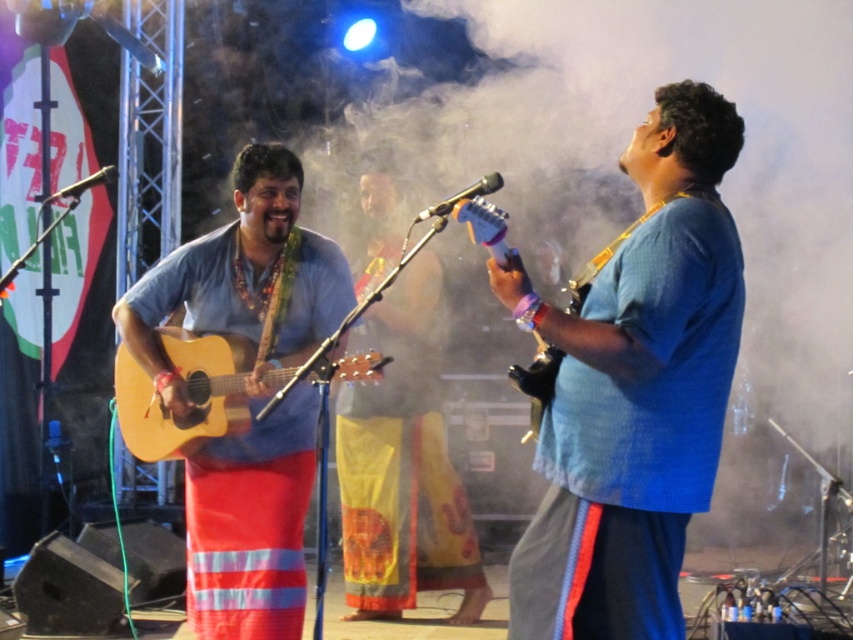
Is matte wood guitar at left thinner than acoustic wood guitar at left?

Correct, matte wood guitar at left's width is less than acoustic wood guitar at left's.

Does point (213, 230) lie behind point (202, 428)?

Yes.

At what (x,y) coordinates should I click in order to perform the action: click on matte wood guitar at left. Please return your answer as a coordinate pair (x, y). The height and width of the screenshot is (640, 853). Looking at the image, I should click on (242, 280).

Is blue cotton shirt at center closer to camera compared to acoustic wood guitar at left?

Yes, it is.

Which is above, blue cotton shirt at center or acoustic wood guitar at left?

blue cotton shirt at center

This screenshot has height=640, width=853. What do you see at coordinates (635, 388) in the screenshot?
I see `blue cotton shirt at center` at bounding box center [635, 388].

The width and height of the screenshot is (853, 640). Identify the location of blue cotton shirt at center. (635, 388).

Describe the element at coordinates (242, 280) in the screenshot. I see `matte wood guitar at left` at that location.

What do you see at coordinates (242, 280) in the screenshot? The width and height of the screenshot is (853, 640). I see `matte wood guitar at left` at bounding box center [242, 280].

At what (x,y) coordinates should I click in order to perform the action: click on matte wood guitar at left. Please return your answer as a coordinate pair (x, y). Looking at the image, I should click on (242, 280).